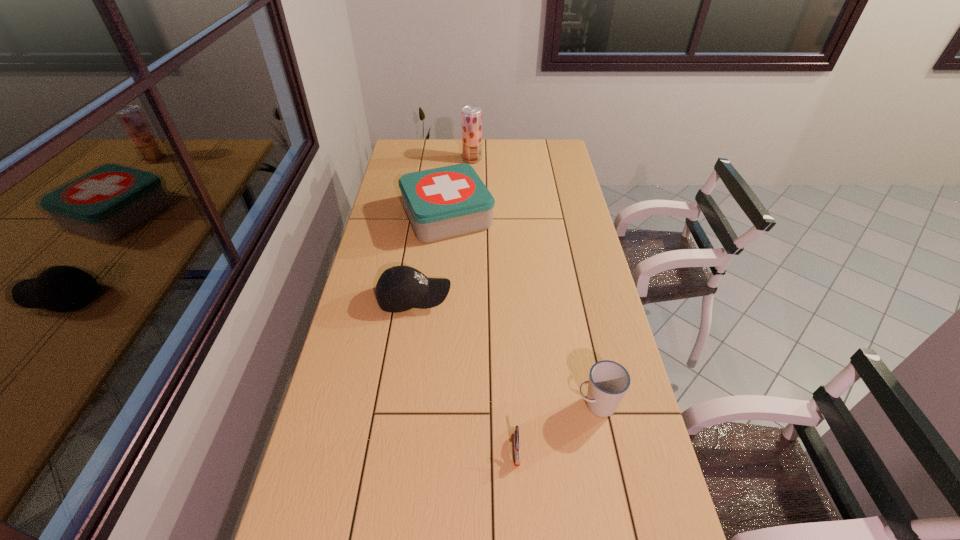
Locate an element on the screen. This screenshot has width=960, height=540. the farthest object is located at coordinates (471, 115).

Image resolution: width=960 pixels, height=540 pixels. I want to click on fruit juice, so click(471, 115).

Where is `the second farthest object`? This screenshot has width=960, height=540. the second farthest object is located at coordinates (445, 202).

I want to click on the rightmost object, so click(608, 382).

The width and height of the screenshot is (960, 540). Identify the location of cup. (608, 382).

Where is `baseball cap`? This screenshot has height=540, width=960. baseball cap is located at coordinates (400, 288).

Find the location of a particular element. Image resolution: width=960 pixels, height=540 pixels. the fourth object from left to right is located at coordinates (516, 433).

Find the location of a particular element. Image resolution: width=960 pixels, height=540 pixels. the nearest object is located at coordinates (516, 433).

I want to click on free region located on the front of the tallest object, so click(471, 199).

This screenshot has height=540, width=960. In order to click on free space located on the right of the second farthest object in this screenshot , I will do `click(539, 216)`.